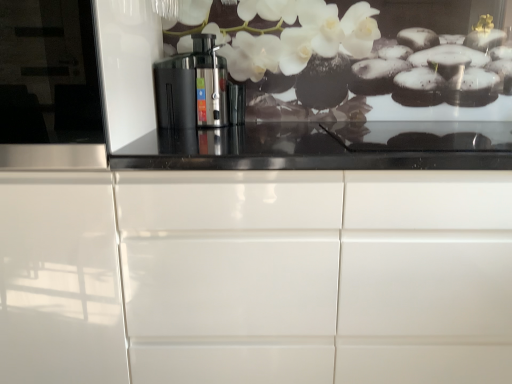
Question: From a real-world perspective, does white glossy cabinet at center sit lower than black plastic juicer at center?

Choices:
 (A) no
 (B) yes

Answer: (B)

Question: Is white glossy cabinet at center positioned in front of black plastic juicer at center?

Choices:
 (A) yes
 (B) no

Answer: (A)

Question: Can you confirm if white glossy cabinet at center is wider than black plastic juicer at center?

Choices:
 (A) yes
 (B) no

Answer: (A)

Question: Is white glossy cabinet at center at the left side of black plastic juicer at center?

Choices:
 (A) no
 (B) yes

Answer: (A)

Question: Considering the relative sizes of white glossy cabinet at center and black plastic juicer at center in the image provided, is white glossy cabinet at center bigger than black plastic juicer at center?

Choices:
 (A) yes
 (B) no

Answer: (A)

Question: From a real-world perspective, is black plastic juicer at center above or below transparent glossy glass door at left?

Choices:
 (A) above
 (B) below

Answer: (B)

Question: Is black plastic juicer at center wider or thinner than transparent glossy glass door at left?

Choices:
 (A) thin
 (B) wide

Answer: (A)

Question: Does point (172, 81) appear closer or farther from the camera than point (23, 51)?

Choices:
 (A) farther
 (B) closer

Answer: (A)

Question: Is black plastic juicer at center inside or outside of transparent glossy glass door at left?

Choices:
 (A) outside
 (B) inside

Answer: (A)

Question: Is point (64, 299) positioned closer to the camera than point (195, 48)?

Choices:
 (A) closer
 (B) farther

Answer: (A)

Question: From the image's perspective, is white glossy cabinet at center positioned above or below black plastic juicer at center?

Choices:
 (A) above
 (B) below

Answer: (B)

Question: From a real-world perspective, is white glossy cabinet at center positioned above or below black plastic juicer at center?

Choices:
 (A) below
 (B) above

Answer: (A)

Question: In terms of width, does white glossy cabinet at center look wider or thinner when compared to black plastic juicer at center?

Choices:
 (A) thin
 (B) wide

Answer: (B)

Question: Considering the positions of point (175, 89) and point (104, 256), is point (175, 89) closer or farther from the camera than point (104, 256)?

Choices:
 (A) farther
 (B) closer

Answer: (A)

Question: From a real-world perspective, is black plastic juicer at center positioned above or below white glossy cabinet at center?

Choices:
 (A) above
 (B) below

Answer: (A)